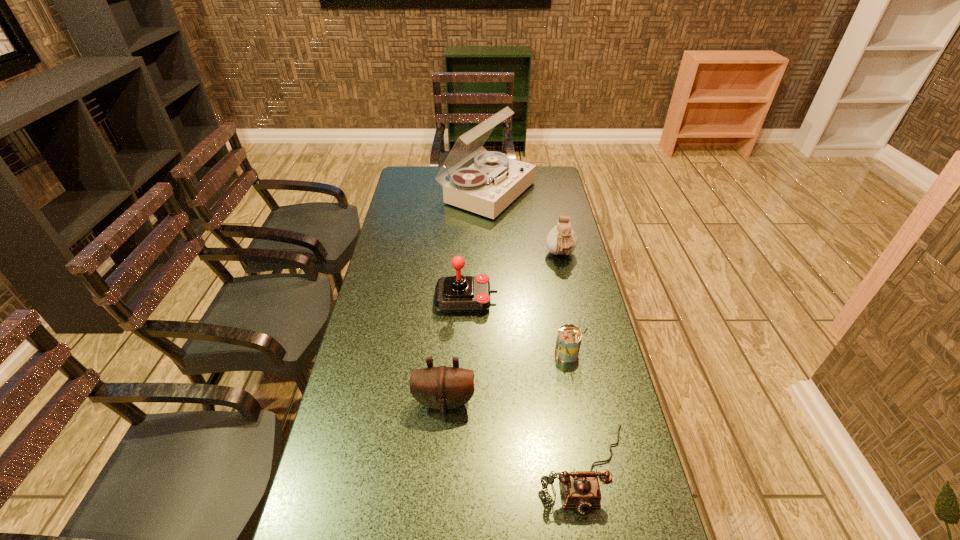
This screenshot has width=960, height=540. Identify the location of object at the far right corner. (488, 186).

The width and height of the screenshot is (960, 540). In the image, there is a desktop. What are the coordinates of `vacant space at the left edge` in the screenshot? It's located at (377, 470).

What are the coordinates of `free location at the right edge` in the screenshot? It's located at (551, 199).

Identify the location of vacant region between the can and the farther pouch. The height and width of the screenshot is (540, 960). (564, 305).

Find the location of a particular element. The height and width of the screenshot is (540, 960). vacant region between the fourth farthest object and the telephone is located at coordinates (577, 411).

Where is `vacant space that's between the nearest object and the left pouch`? This screenshot has height=540, width=960. vacant space that's between the nearest object and the left pouch is located at coordinates (515, 435).

Identify the location of vacant area that lies between the right pouch and the record player. The height and width of the screenshot is (540, 960). (524, 224).

At what (x,y) coordinates should I click in order to perform the action: click on free area in between the tallest object and the telephone. Please return your answer as a coordinate pair (x, y). Looking at the image, I should click on (536, 330).

The image size is (960, 540). I want to click on free area in between the record player and the third nearest object, so click(528, 273).

You are a GUI agent. You are given a task and a screenshot of the screen. Output one action in this format:
    pyautogui.click(x=<x>, y=<y>)
    Task: Click on the vacant area that lies between the joystick and the nearer pouch
    The height and width of the screenshot is (540, 960).
    Given the screenshot: What is the action you would take?
    pyautogui.click(x=455, y=350)